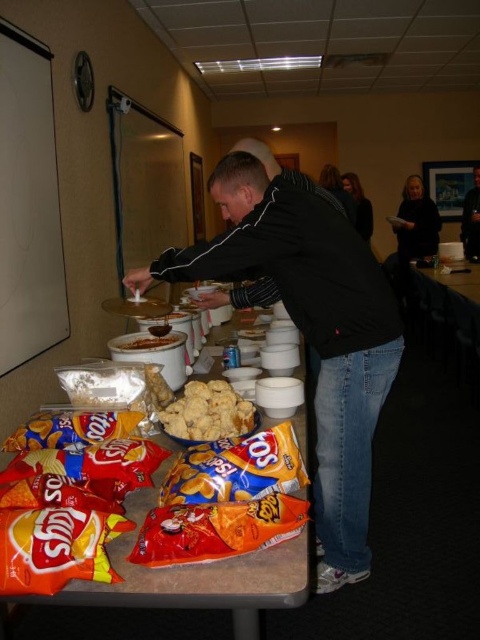
Based on the photo, you are at the food station and want to grab a cookie from the matte brown cookies at center. As you reach for it, you notice a person wearing a smooth black shirt at upper right. In which direction should you move your hand to avoid touching the person?

To avoid touching the person wearing the smooth black shirt at upper right, move your hand to the left since the smooth black shirt at upper right is to the right of the matte brown cookies at center.

You are organizing a buffet table and need to arrange items based on their widths. You have a smooth black shirt at upper right and matte brown cookies at center. Which item should you place on the wider section of the table to fit better?

The smooth black shirt at upper right should be placed on the wider section of the table since its width surpasses that of the matte brown cookies at center.